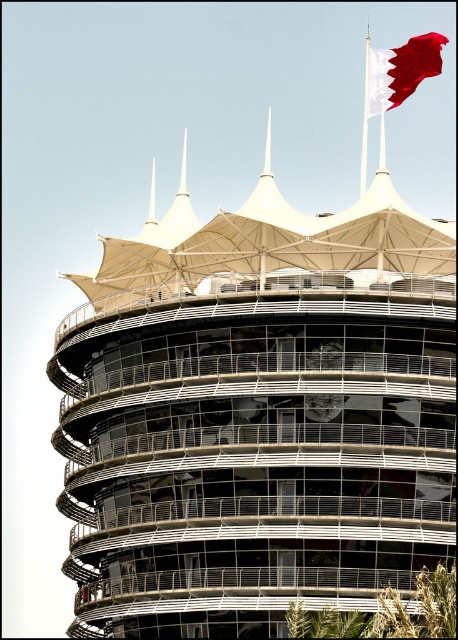
Question: Among these objects, which one is nearest to the camera?

Choices:
 (A) white fabric flag at upper right
 (B) white glass tower at center

Answer: (B)

Question: Can you confirm if white glass tower at center is bigger than white fabric flag at upper right?

Choices:
 (A) no
 (B) yes

Answer: (B)

Question: Which point is farther to the camera?

Choices:
 (A) white glass tower at center
 (B) white fabric flag at upper right

Answer: (B)

Question: From the image, what is the correct spatial relationship of white glass tower at center in relation to white fabric flag at upper right?

Choices:
 (A) below
 (B) above

Answer: (A)

Question: Can you confirm if white glass tower at center is positioned above white fabric flag at upper right?

Choices:
 (A) yes
 (B) no

Answer: (B)

Question: Which point is closer to the camera?

Choices:
 (A) (370, 80)
 (B) (260, 544)

Answer: (B)